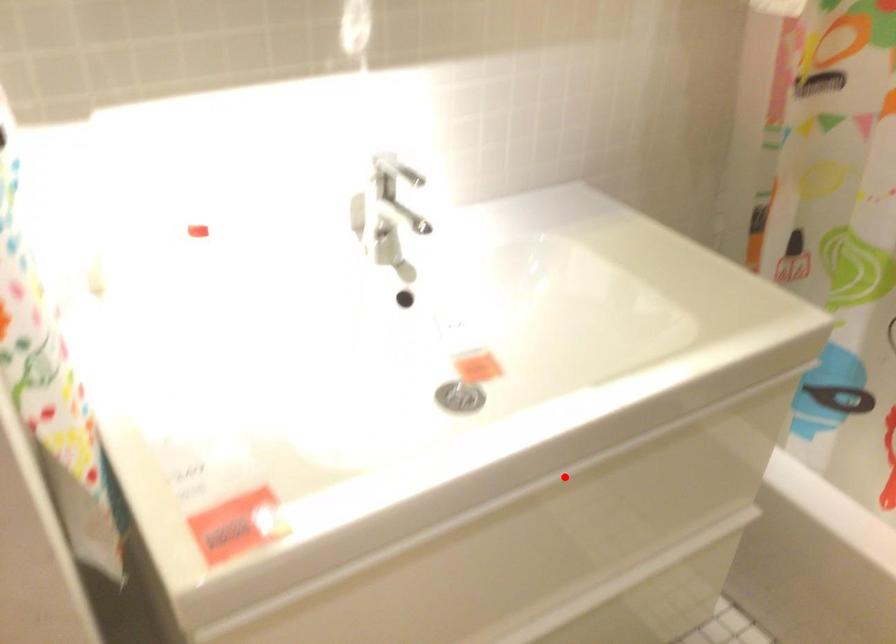
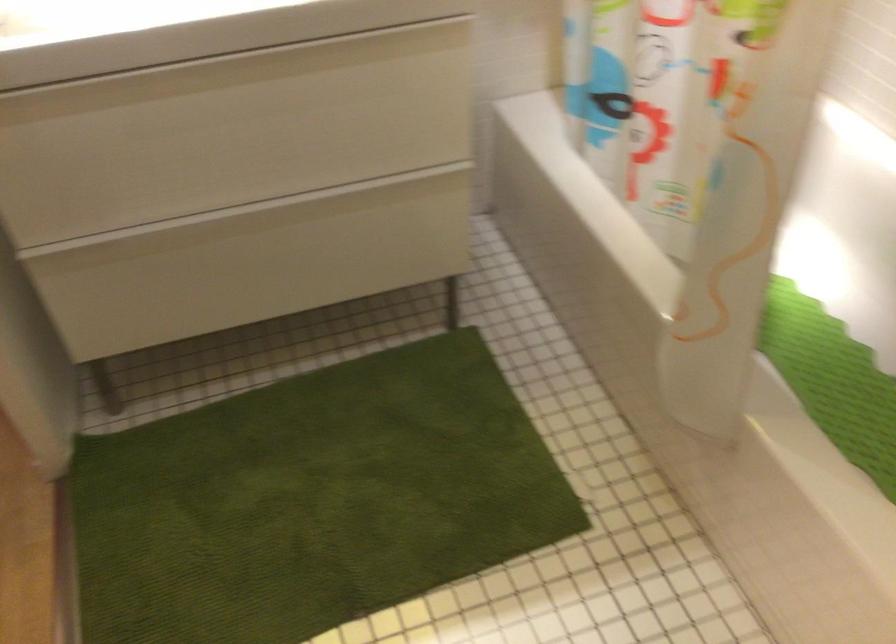
Question: A red point is marked in image1. In image2, is the corresponding 3D point closer to the camera or farther? Reply with the corresponding letter.

Choices:
 (A) The corresponding 3D point is closer.
 (B) The corresponding 3D point is farther.

Answer: (B)